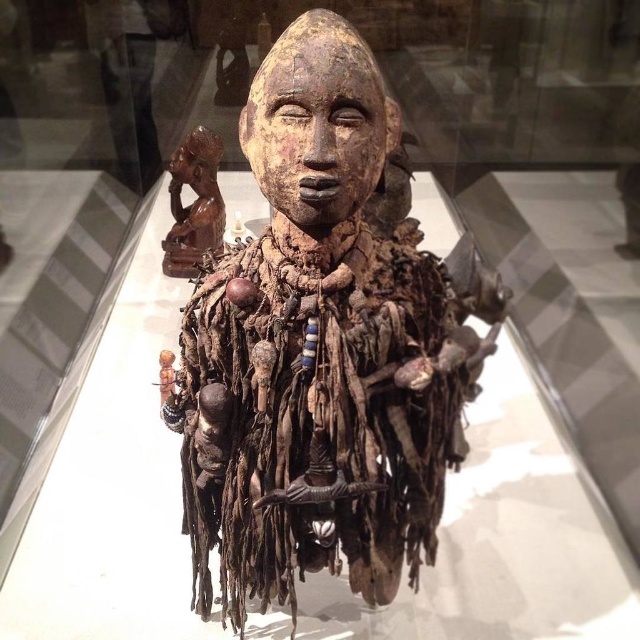
Question: Can you confirm if wooden figure at center is positioned above matte brown wooden head at upper left?

Choices:
 (A) no
 (B) yes

Answer: (A)

Question: In this image, where is wooden figure at center located relative to matte brown wooden head at upper left?

Choices:
 (A) above
 (B) below

Answer: (B)

Question: Which point is closer to the camera?

Choices:
 (A) wooden figure at center
 (B) matte brown wooden head at upper left
 (C) wooden carved head at center
 (D) brown wooden figurine at upper left

Answer: (C)

Question: Among these points, which one is farthest from the camera?

Choices:
 (A) (371, 172)
 (B) (248, 284)
 (C) (202, 212)

Answer: (C)

Question: Which object is positioned closest to the wooden carved head at center?

Choices:
 (A) matte brown wooden head at upper left
 (B) brown wooden figurine at upper left
 (C) wooden figure at center

Answer: (C)

Question: Does wooden carved head at center appear on the right side of brown wooden figurine at upper left?

Choices:
 (A) yes
 (B) no

Answer: (A)